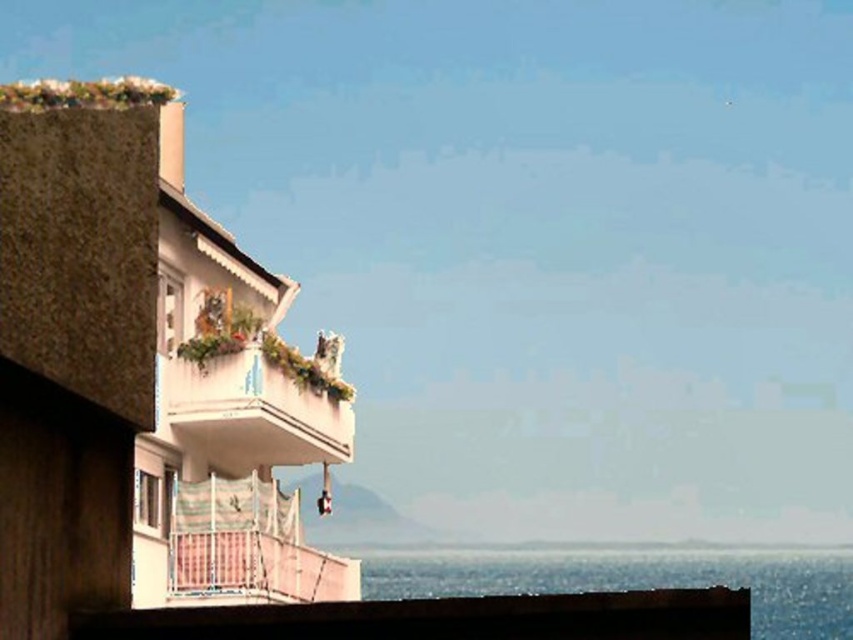
Does smooth concrete ledge at lower center have a lesser height compared to white textured balcony at upper center?

Correct, smooth concrete ledge at lower center is not as tall as white textured balcony at upper center.

Can you confirm if smooth concrete ledge at lower center is positioned below white textured balcony at upper center?

Actually, smooth concrete ledge at lower center is above white textured balcony at upper center.

What do you see at coordinates (445, 618) in the screenshot? The width and height of the screenshot is (853, 640). I see `smooth concrete ledge at lower center` at bounding box center [445, 618].

This screenshot has width=853, height=640. I want to click on smooth concrete ledge at lower center, so click(x=445, y=618).

Between blue water at lower right and white textured balcony at upper center, which one appears on the left side from the viewer's perspective?

white textured balcony at upper center

Can you confirm if blue water at lower right is taller than white textured balcony at upper center?

Yes.

Between point (375, 573) and point (178, 444), which one is positioned in front?

Positioned in front is point (178, 444).

Identify the location of blue water at lower right. This screenshot has width=853, height=640. (635, 579).

Based on the photo, is smooth concrete ledge at lower center thinner than blue water at lower right?

Yes, smooth concrete ledge at lower center is thinner than blue water at lower right.

Is point (479, 630) positioned before point (798, 637)?

Yes.

Which is in front, point (213, 624) or point (815, 609)?

Positioned in front is point (213, 624).

The image size is (853, 640). In order to click on smooth concrete ledge at lower center in this screenshot , I will do `click(445, 618)`.